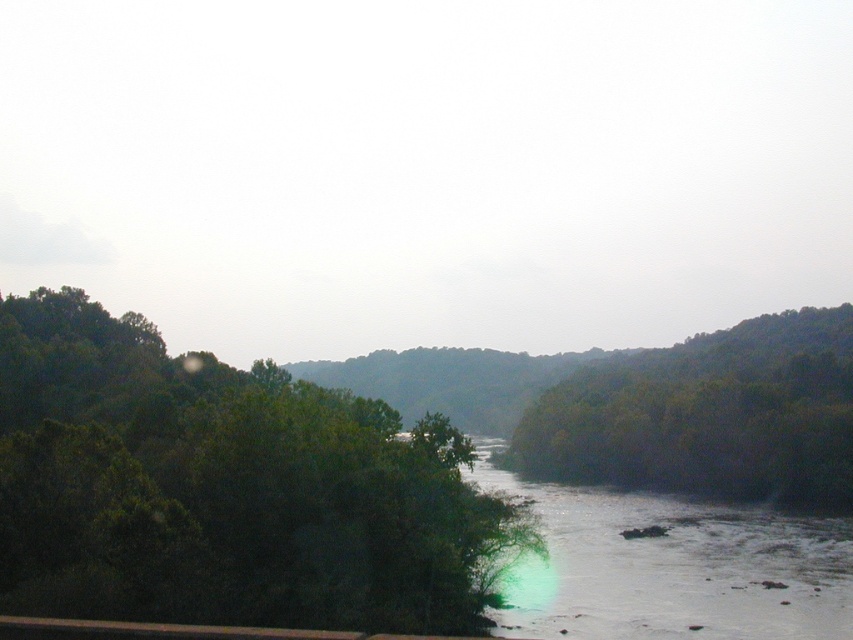
You are a photographer standing on a bridge overlooking the river. You want to capture a photo that includes both the green leafy tree at left and the clear water at center. Based on their positions, will the tree appear to be leaning over the water in the photo?

Yes, the green leafy tree at left is positioned over clear water at center, so in the photo taken from the bridge, the tree will appear to be leaning over the water.

You are standing on a bridge overlooking the river and want to take a photo that includes both the green leafy tree at left and the clear water at center. Which object should you adjust your camera angle to focus on first to ensure both are in the frame?

The green leafy tree at left might be wider than the clear water at center, so you should adjust your camera angle to focus on the green leafy tree at left first to ensure both are in the frame.